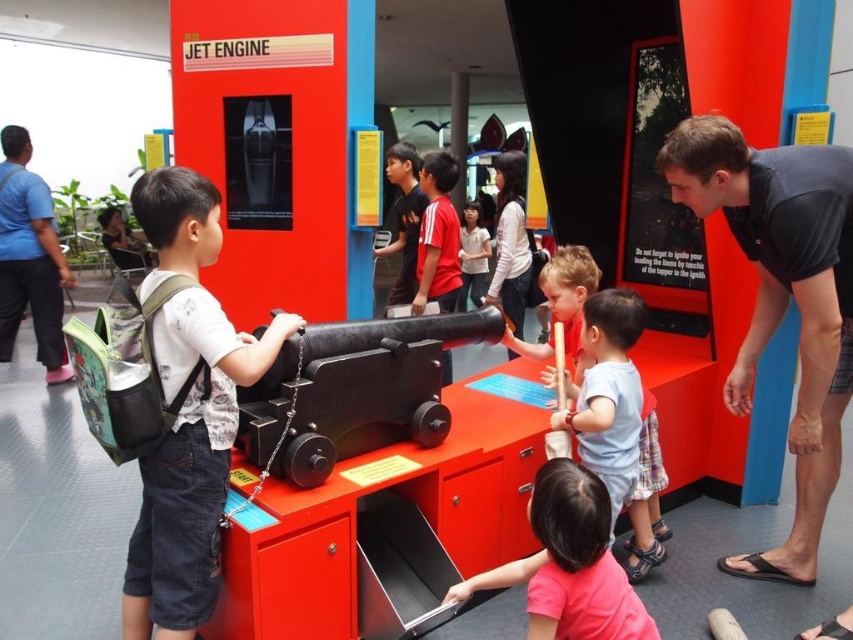
Is matte black shirt at center positioned before white matte shirt at center?

Yes, it is in front of white matte shirt at center.

Can you confirm if matte black shirt at center is taller than white matte shirt at center?

In fact, matte black shirt at center may be shorter than white matte shirt at center.

Find the location of a particular element. The image size is (853, 640). matte black shirt at center is located at coordinates (404, 218).

The width and height of the screenshot is (853, 640). I want to click on matte black shirt at center, so click(x=404, y=218).

Which is more to the right, light blue cotton shirt at center or red matte shirt at center?

Positioned to the right is light blue cotton shirt at center.

This screenshot has width=853, height=640. Describe the element at coordinates (618, 420) in the screenshot. I see `light blue cotton shirt at center` at that location.

This screenshot has width=853, height=640. Describe the element at coordinates (618, 420) in the screenshot. I see `light blue cotton shirt at center` at that location.

Identify the location of light blue cotton shirt at center. The width and height of the screenshot is (853, 640). pyautogui.click(x=618, y=420).

Which is more to the left, matte black backpack at left or brushed metal backpack at left?

Positioned to the left is brushed metal backpack at left.

I want to click on matte black backpack at left, so click(190, 465).

Describe the element at coordinates (190, 465) in the screenshot. I see `matte black backpack at left` at that location.

Where is `matte black backpack at left`? This screenshot has width=853, height=640. matte black backpack at left is located at coordinates (190, 465).